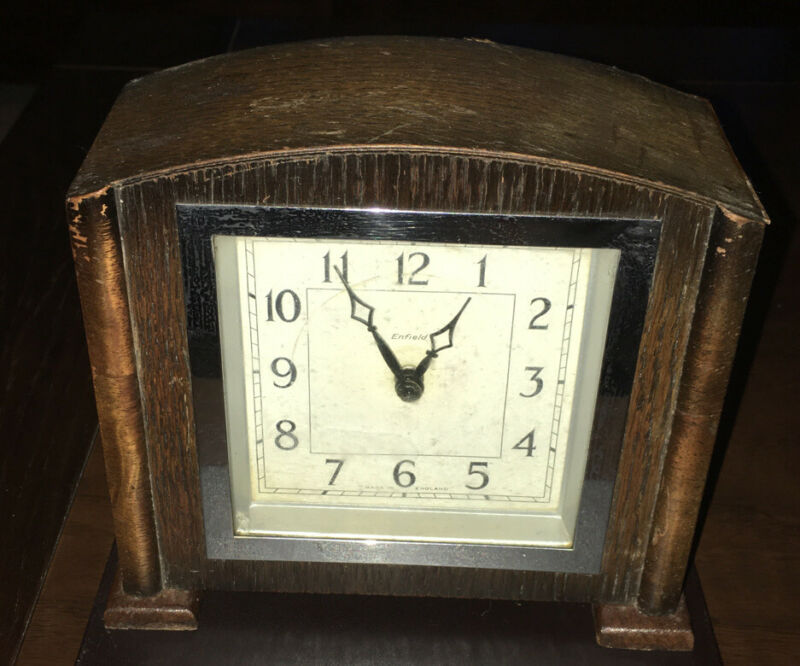
Locate an element on the screen. The width and height of the screenshot is (800, 666). wood the clock is made of is located at coordinates (125, 252), (690, 308), (446, 111).